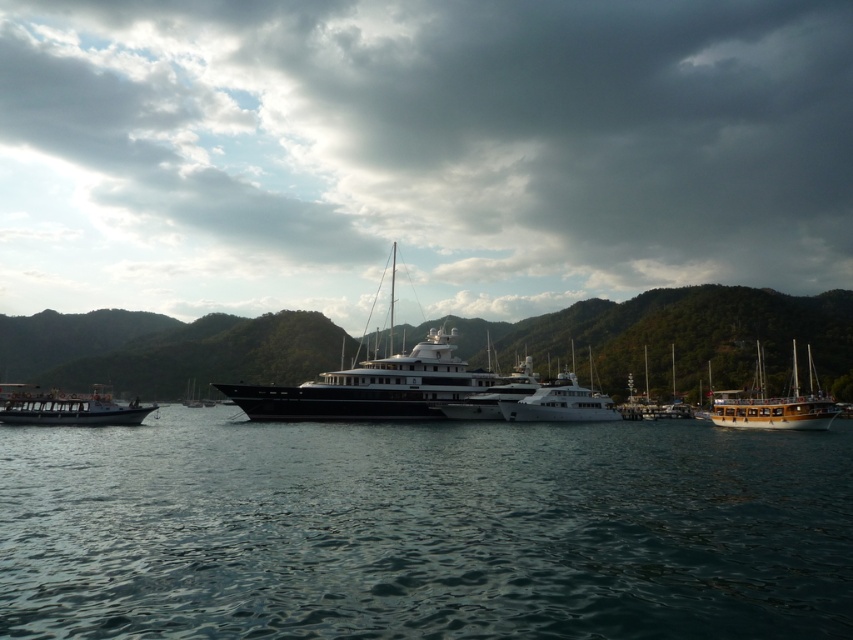
Question: Among these objects, which one is nearest to the camera?

Choices:
 (A) metallic gray boat at left
 (B) green forested mountain at center
 (C) white glossy yacht at center

Answer: (A)

Question: Is metallic gray boat at left in front of white glossy yacht at center?

Choices:
 (A) yes
 (B) no

Answer: (A)

Question: Considering the real-world distances, which object is closest to the green forested mountain at center?

Choices:
 (A) wooden sailboat at right
 (B) cloudy sky at upper center

Answer: (A)

Question: Does wooden sailboat at right have a smaller size compared to metallic gray boat at left?

Choices:
 (A) yes
 (B) no

Answer: (A)

Question: Is the position of cloudy sky at upper center more distant than that of green forested mountain at center?

Choices:
 (A) yes
 (B) no

Answer: (A)

Question: Which point is closer to the camera taking this photo?

Choices:
 (A) (805, 413)
 (B) (151, 339)
 (C) (128, 417)
 (D) (462, 289)

Answer: (C)